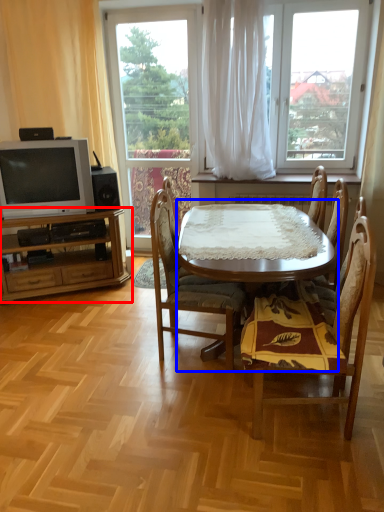
Question: Which point is closer to the camera, cabinetry (highlighted by a red box) or round table (highlighted by a blue box)?

Choices:
 (A) cabinetry
 (B) round table

Answer: (B)